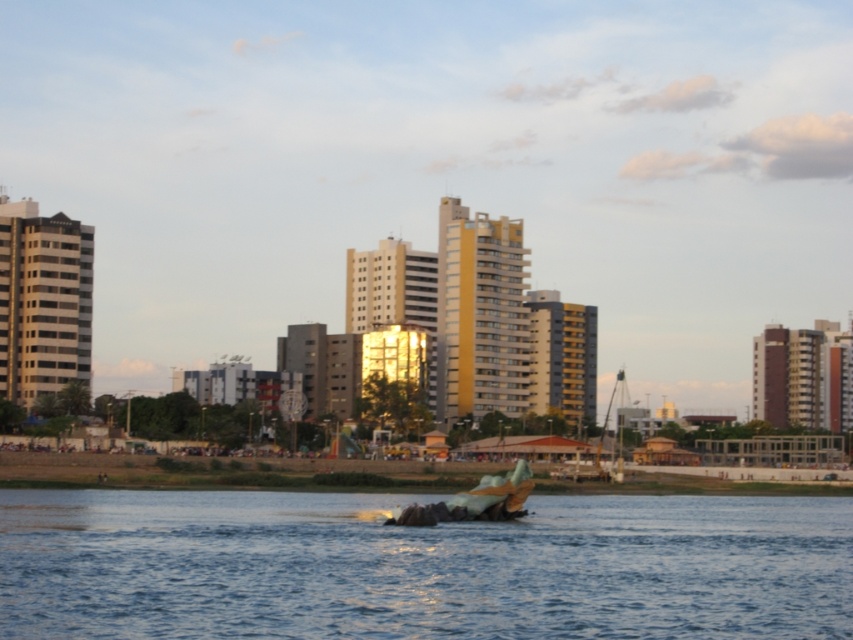
Question: Does blue water at center have a smaller size compared to metallic silver boat at center?

Choices:
 (A) no
 (B) yes

Answer: (A)

Question: Which of the following is the closest to the observer?

Choices:
 (A) smooth concrete shoreline at center
 (B) blue water at center
 (C) metallic silver boat at center

Answer: (B)

Question: Does blue water at center appear on the left side of metallic silver boat at center?

Choices:
 (A) yes
 (B) no

Answer: (A)

Question: Which point is closer to the camera?

Choices:
 (A) metallic silver boat at center
 (B) smooth concrete shoreline at center

Answer: (B)

Question: Is smooth concrete shoreline at center to the right of metallic silver boat at center from the viewer's perspective?

Choices:
 (A) no
 (B) yes

Answer: (A)

Question: Which point is closer to the camera?

Choices:
 (A) (527, 582)
 (B) (370, 461)
 (C) (552, 474)

Answer: (A)